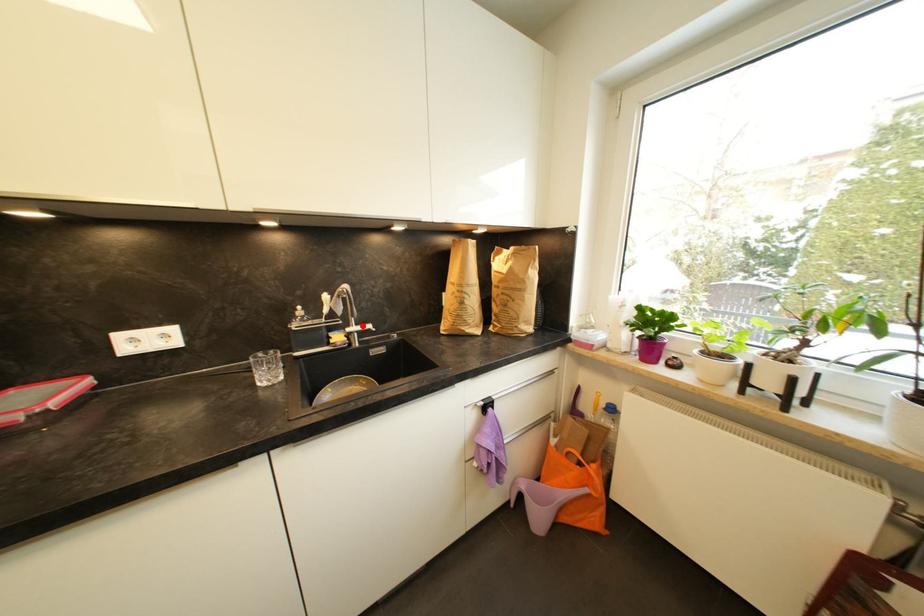
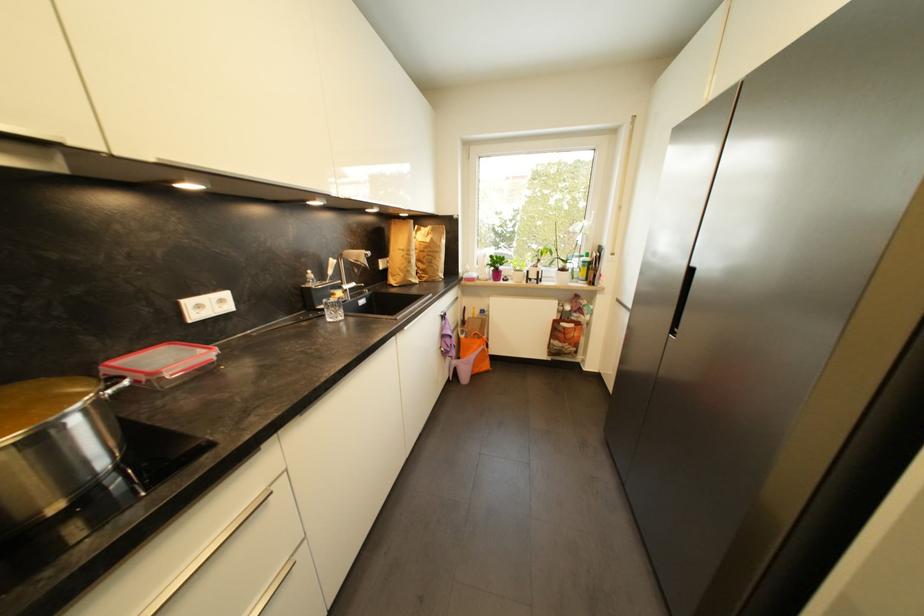
Where in the second image is the point corresponding to the highlighted location from the first image?

(353, 285)